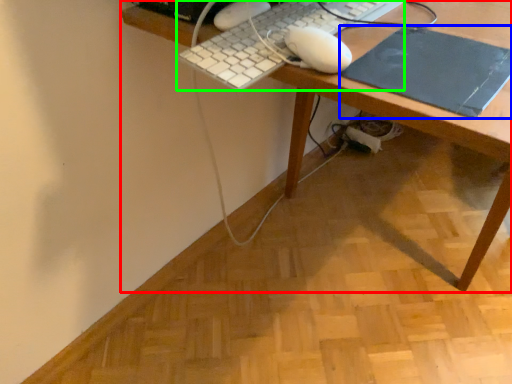
Question: Which object is positioned closest to desk (highlighted by a red box)? Select from mousepad (highlighted by a blue box) and computer keyboard (highlighted by a green box).

Choices:
 (A) mousepad
 (B) computer keyboard

Answer: (A)